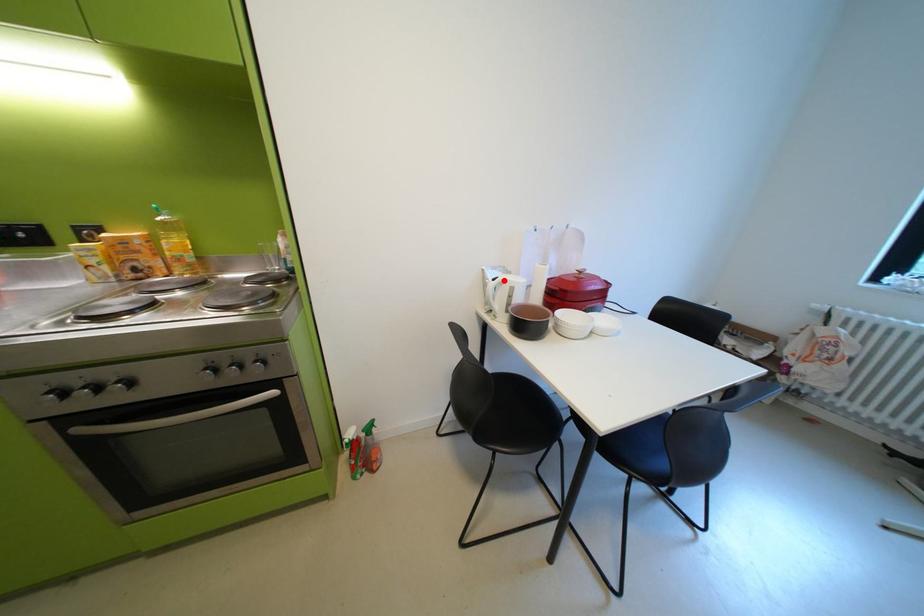
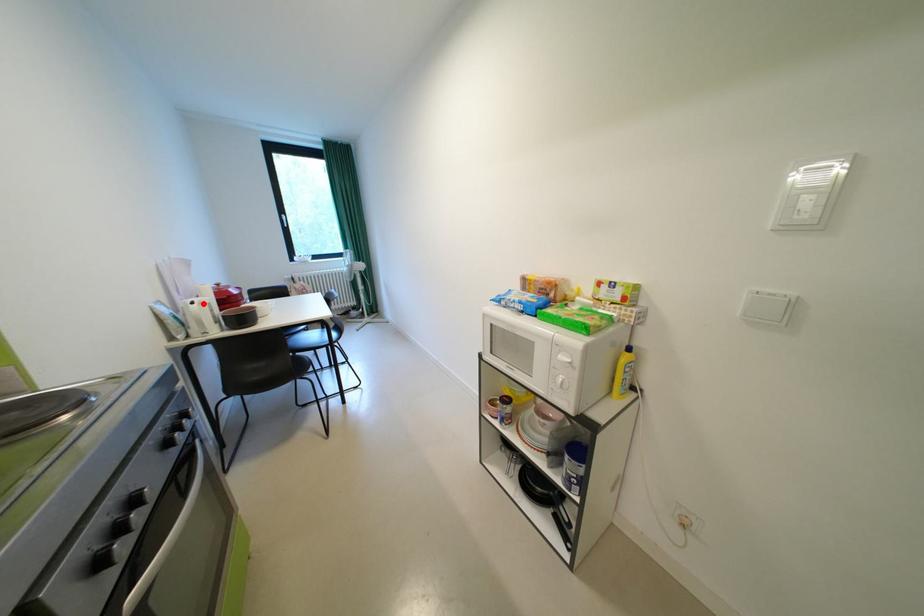
I am providing you with two images of the same scene from different viewpoints. A red point is marked on the first image and another point is marked on the second image. Does the point marked in image1 correspond to the same location as the one in image2?

Yes